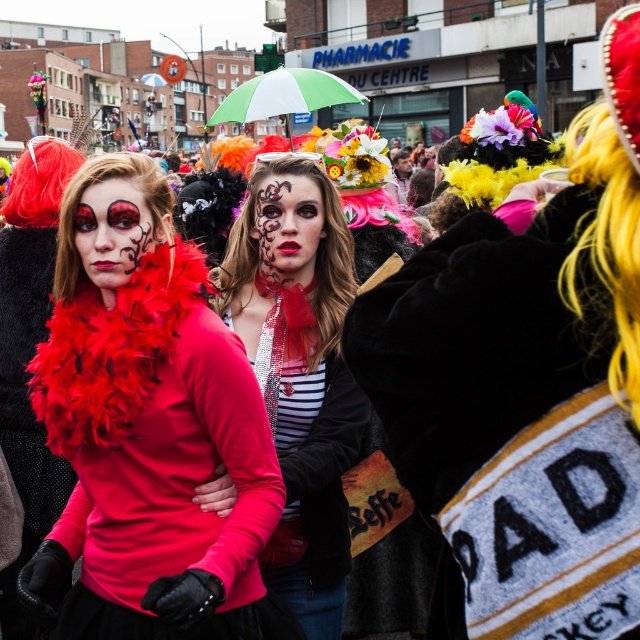
You are a photographer positioned at the edge of the street scene. You want to capture a clear shot of the matte black dress at center without the green and white striped umbrella at center obstructing it. Based on their positions, is this possible?

The matte black dress at center is in front of the green and white striped umbrella at center, so the dress will block the view of the umbrella. Therefore, you can capture a clear shot of the matte black dress at center without the umbrella obstructing it.

You are a photographer trying to capture a photo of the matte black dress at center and the green and white striped umbrella at center. Based on their sizes, which object should you focus on first to ensure it fits entirely within the frame?

The matte black dress at center occupies less space than the green and white striped umbrella at center, so you should focus on the green and white striped umbrella at center first to ensure it fits entirely within the frame.